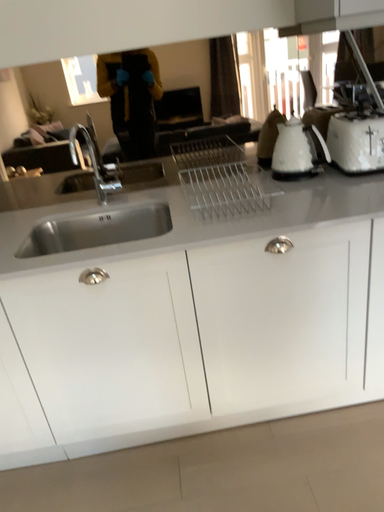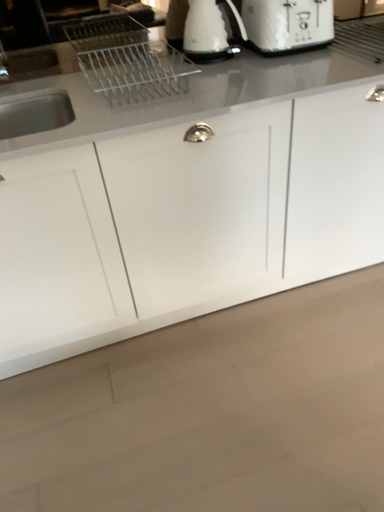
Question: How did the camera likely rotate when shooting the video?

Choices:
 (A) rotated left
 (B) rotated right

Answer: (B)